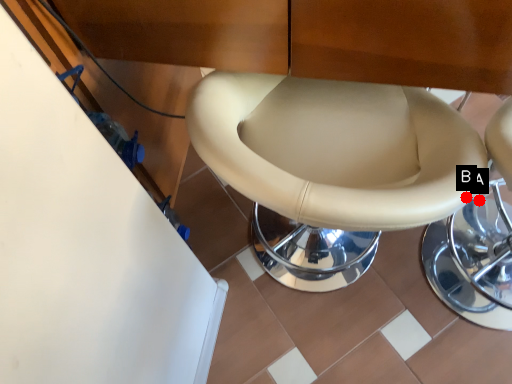
Question: Two points are circled on the image, labeled by A and B beside each circle. Which of the following is the closest to the observer?

Choices:
 (A) A is closer
 (B) B is closer

Answer: (B)